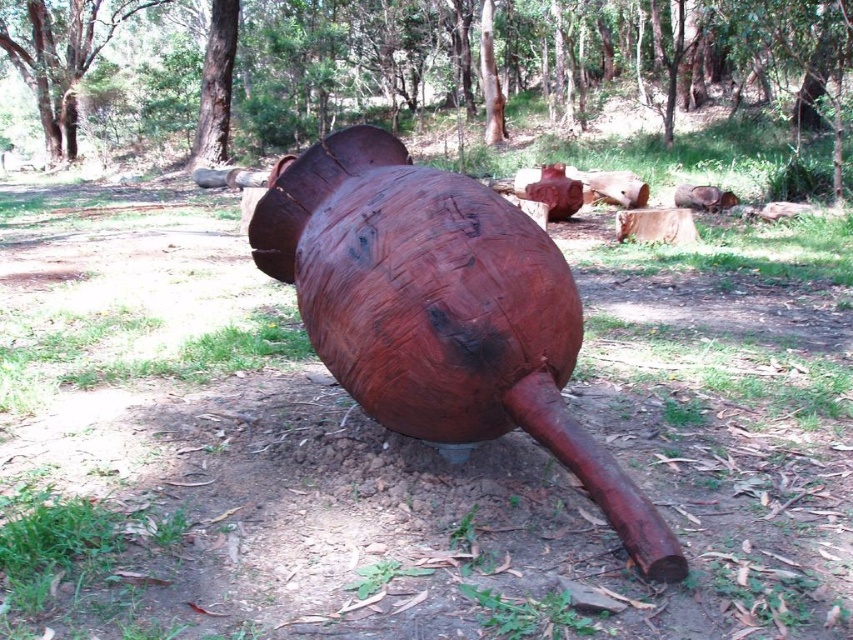
Can you confirm if smooth brown wooden log at center is positioned to the left of smooth brown tree trunk at upper left?

No, smooth brown wooden log at center is not to the left of smooth brown tree trunk at upper left.

Between smooth brown wooden log at center and smooth brown tree trunk at upper left, which one has more height?

smooth brown wooden log at center

Is point (621, 88) closer to viewer compared to point (90, 12)?

No, it is behind (90, 12).

Find the location of `smooth brown wooden log at center`. smooth brown wooden log at center is located at coordinates (416, 67).

Between rustic wood sculpture at center and smooth brown tree trunk at upper left, which one is positioned higher?

smooth brown tree trunk at upper left is higher up.

Does point (550, 252) come closer to viewer compared to point (28, 6)?

Yes.

Is point (509, 401) positioned after point (94, 38)?

No, it is in front of (94, 38).

Identify the location of rustic wood sculpture at center. (440, 310).

Who is more distant from viewer, (747,0) or (524,234)?

The point (747,0) is behind.

Does smooth brown wooden log at center have a lesser width compared to rustic wood sculpture at center?

No, smooth brown wooden log at center is not thinner than rustic wood sculpture at center.

Which is behind, point (828, 124) or point (519, 344)?

Positioned behind is point (828, 124).

Where is `smooth brown wooden log at center`? The image size is (853, 640). smooth brown wooden log at center is located at coordinates (416, 67).